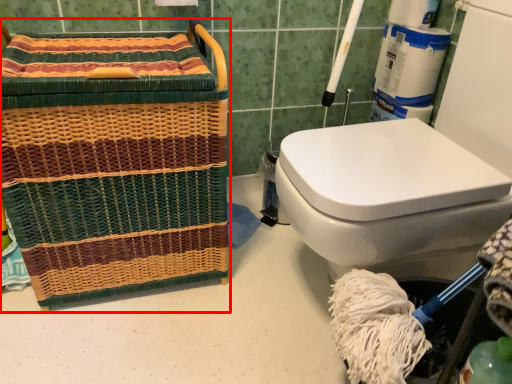
Question: From the image's perspective, considering the relative positions of basket (annotated by the red box) and teal in the image provided, where is basket (annotated by the red box) located with respect to the staircase?

Choices:
 (A) below
 (B) above

Answer: (B)